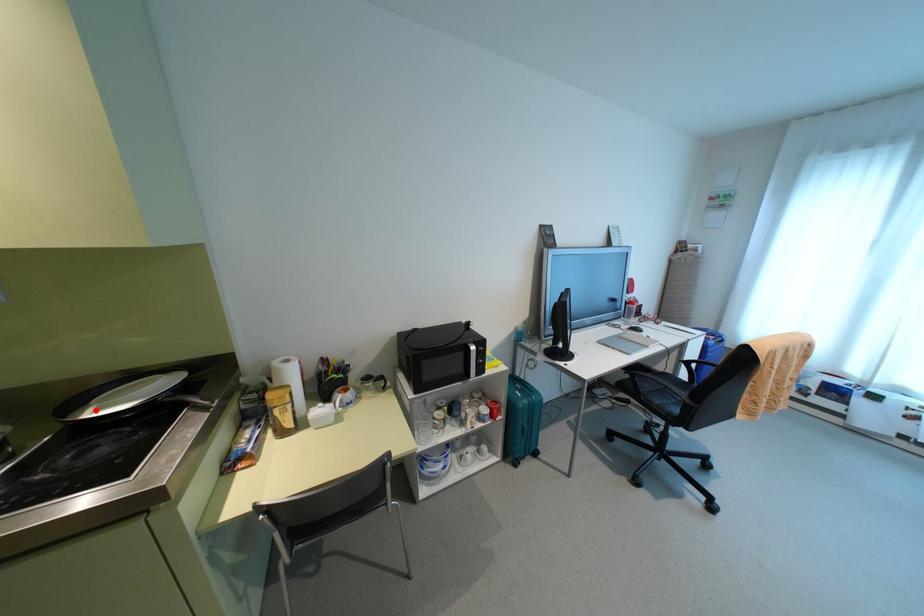
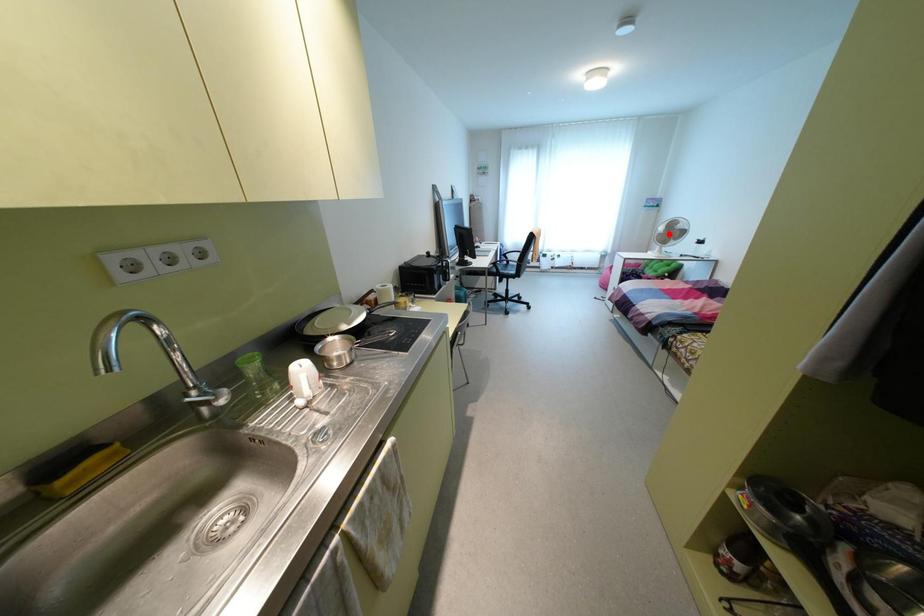
I am providing you with two images of the same scene from different viewpoints. A red point is marked on the first image and another point is marked on the second image. Do the highlighted points in image1 and image2 indicate the same real-world spot?

No